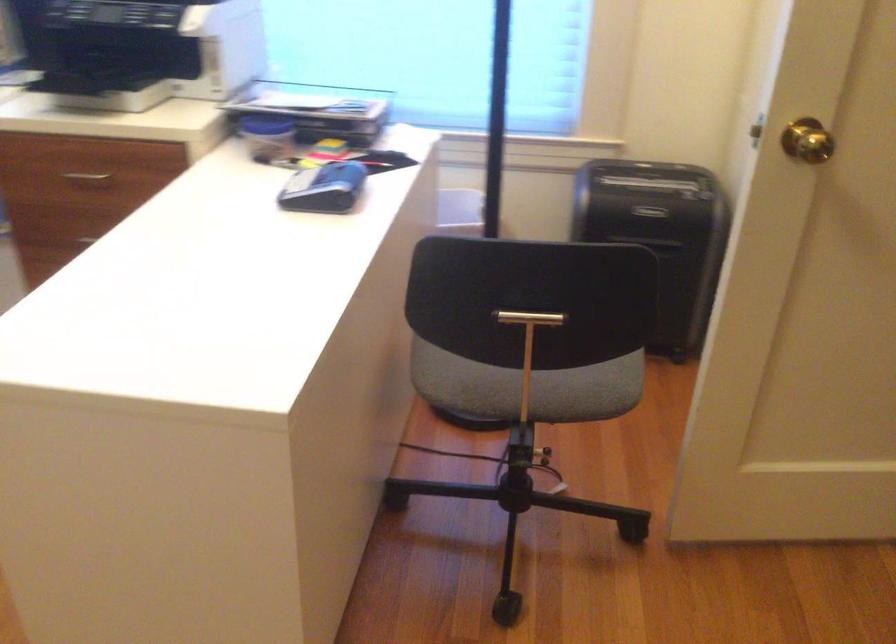
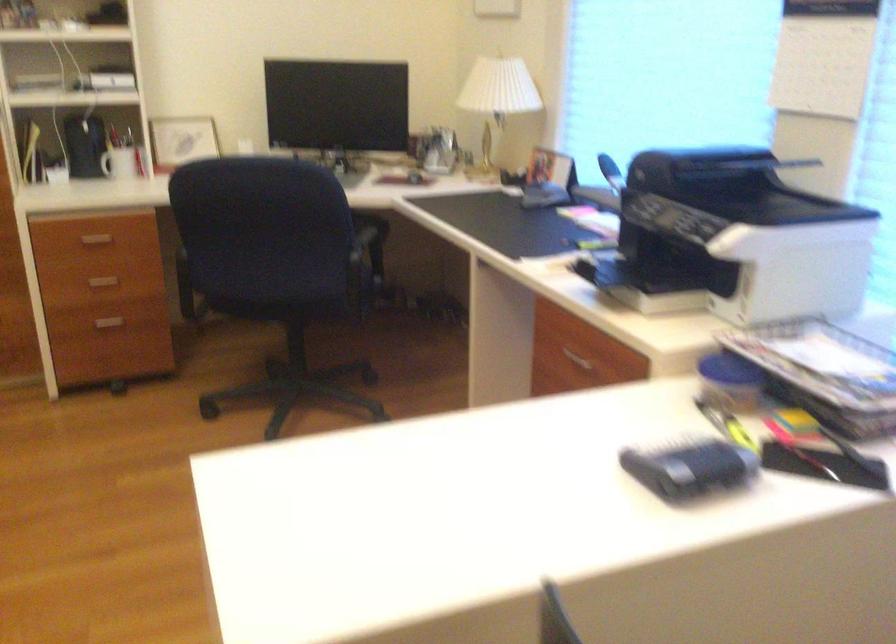
Question: The first image is from the beginning of the video and the second image is from the end. How did the camera likely rotate when shooting the video?

Choices:
 (A) Left
 (B) Right
 (C) Up
 (D) Down

Answer: (A)